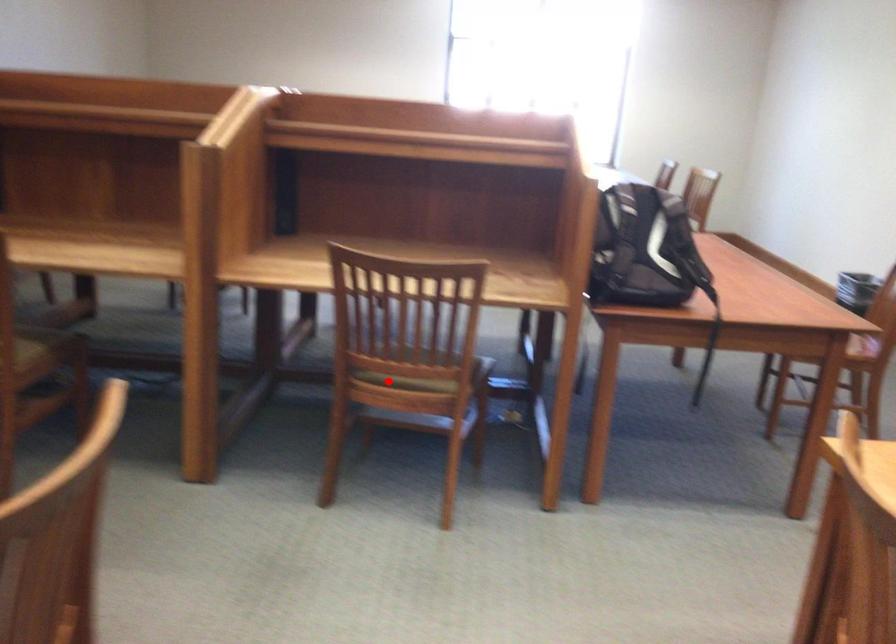
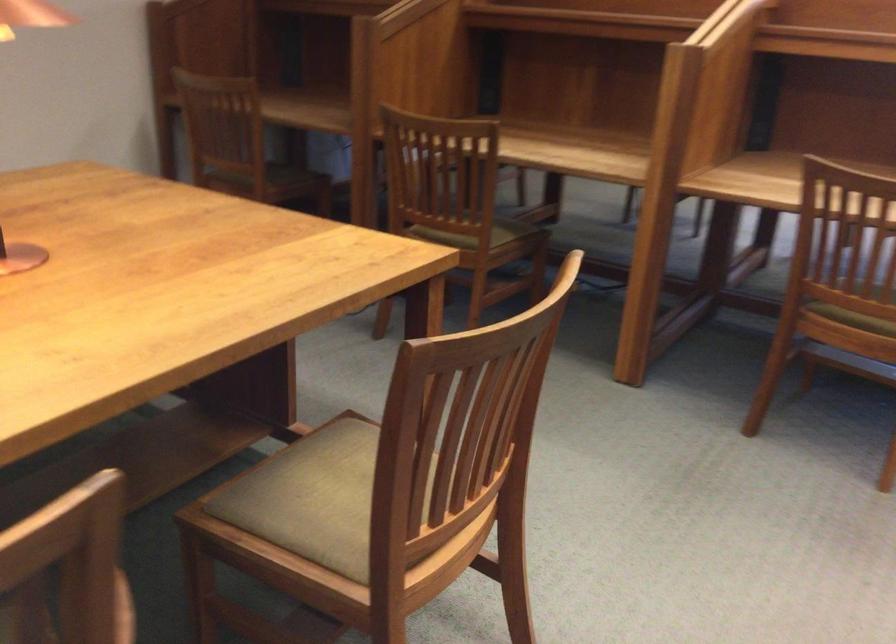
Question: I am providing you with two images of the same scene from different viewpoints. Given a red point in image1, look at the same physical point in image2. Is it:

Choices:
 (A) Closer to the viewpoint
 (B) Farther from the viewpoint

Answer: (A)